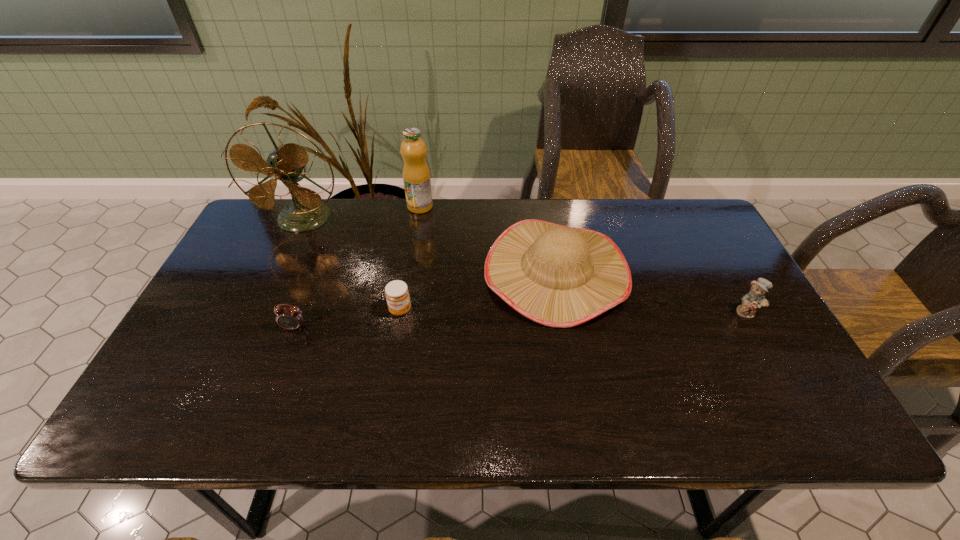
Locate an element on the screen. The height and width of the screenshot is (540, 960). the tallest object is located at coordinates (286, 162).

The height and width of the screenshot is (540, 960). I want to click on fruit juice, so click(x=416, y=175).

Locate an element on the screen. sunhat is located at coordinates (559, 276).

The height and width of the screenshot is (540, 960). I want to click on the fifth object from left to right, so click(559, 276).

You are a GUI agent. You are given a task and a screenshot of the screen. Output one action in this format:
    pyautogui.click(x=<x>, y=<y>)
    Task: Click on the fourth tallest object
    The height and width of the screenshot is (540, 960).
    Given the screenshot: What is the action you would take?
    pyautogui.click(x=755, y=298)

Identify the location of teddy bear. point(755,298).

The height and width of the screenshot is (540, 960). I want to click on alarm clock, so click(291, 318).

Where is `jam`? This screenshot has height=540, width=960. jam is located at coordinates (397, 295).

Where is `free space located in front of the fan, directing air flow`? free space located in front of the fan, directing air flow is located at coordinates (289, 249).

The image size is (960, 540). In order to click on vacant space located on the front label of the fruit juice in this screenshot , I will do pos(416,232).